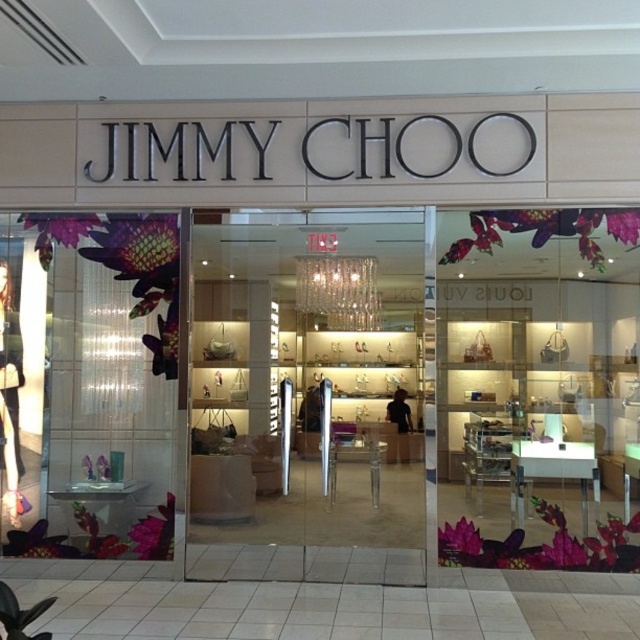
You are standing outside the Jimmy Choo boutique and want to enter through the transparent glass door at center. Based on its position coordinates, can you estimate where to walk towards to reach it?

The transparent glass door at center is located at coordinates point [307,396], so you should walk towards the central area of the store entrance to reach it.